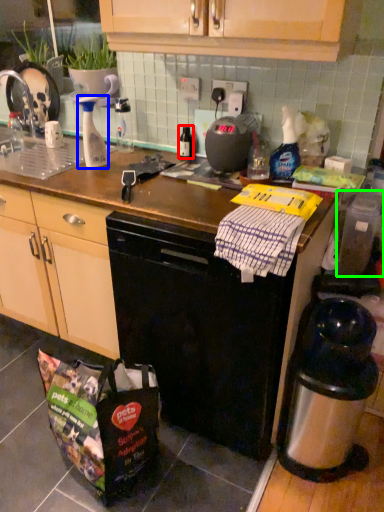
Question: Which object is the farthest from bottle (highlighted by a red box)? Choose among these: bottle (highlighted by a blue box) or appliance (highlighted by a green box).

Choices:
 (A) bottle
 (B) appliance

Answer: (B)